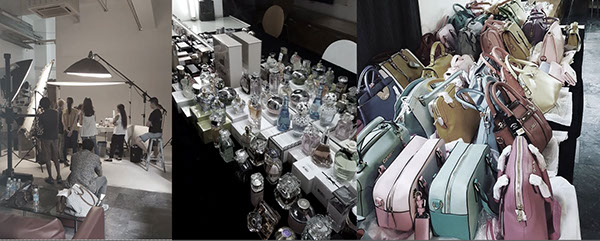
Find the location of a particular element. The image size is (600, 241). glass bottle is located at coordinates (345, 167).